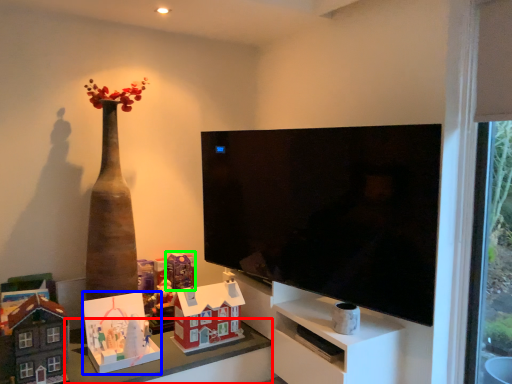
Question: Based on their relative distances, which object is farther from table (highlighted by a red box)? Choose from toy (highlighted by a blue box) and toy (highlighted by a green box).

Choices:
 (A) toy
 (B) toy

Answer: (B)